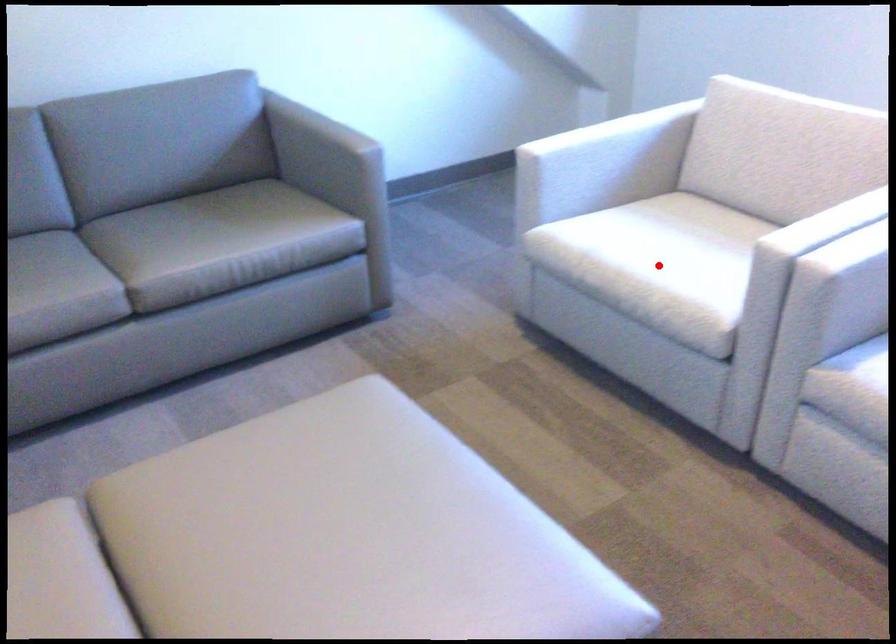
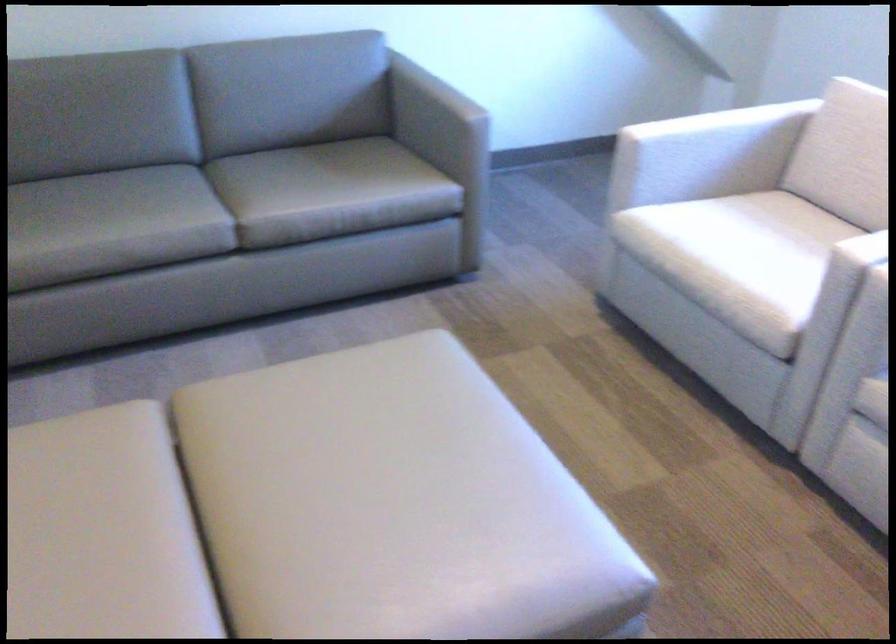
The point at the highlighted location is marked in the first image. Where is the corresponding point in the second image?

(737, 261)